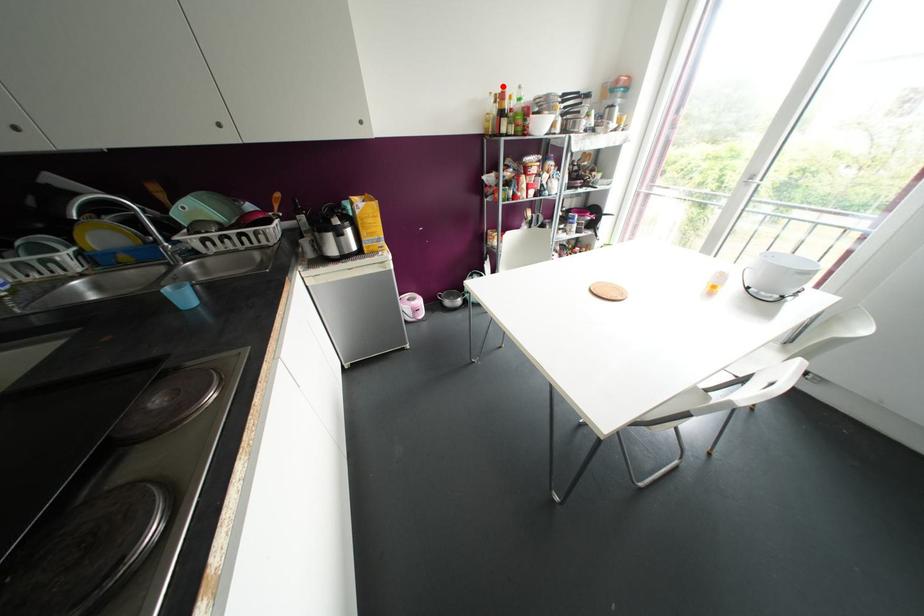
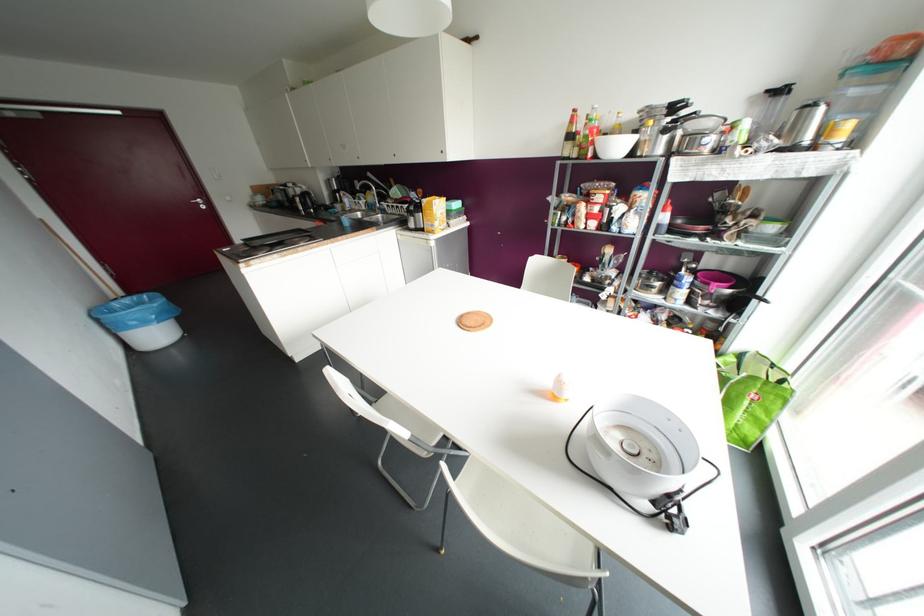
In the second image, find the point that corresponds to the highlighted location in the first image.

(574, 110)